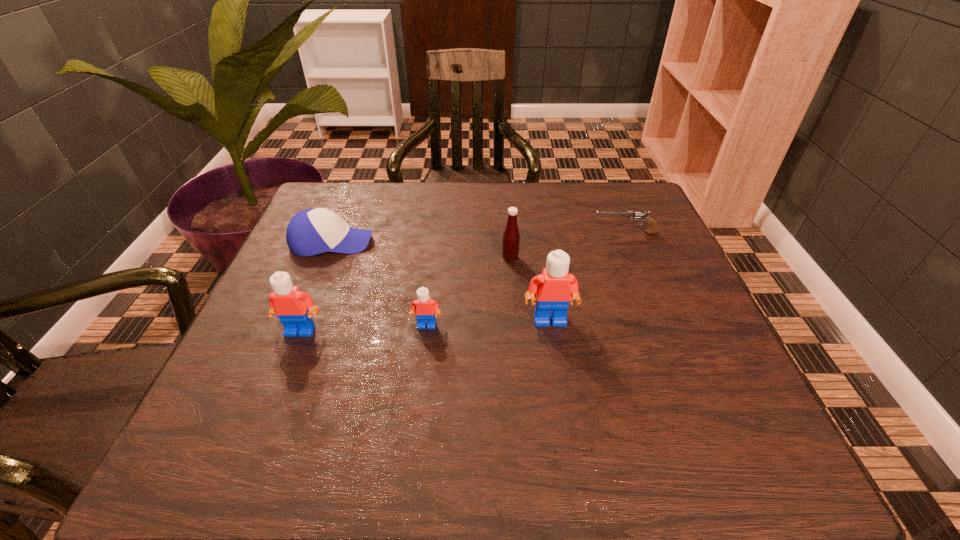
Locate an element on the screen. This screenshot has height=540, width=960. the leftmost Lego is located at coordinates (287, 302).

Identify the location of the fourth object from right to left. The image size is (960, 540). (424, 307).

Locate an element on the screen. The width and height of the screenshot is (960, 540). the shortest Lego is located at coordinates (424, 307).

Find the location of `the rightmost Lego`. the rightmost Lego is located at coordinates tap(555, 287).

Image resolution: width=960 pixels, height=540 pixels. What are the coordinates of `the rightmost object` in the screenshot? It's located at (652, 229).

Where is `gun`? The image size is (960, 540). gun is located at coordinates (652, 229).

You are a GUI agent. You are given a task and a screenshot of the screen. Output one action in this format:
    pyautogui.click(x=<x>, y=<y>)
    Task: Click on the Tabasco sauce
    Image resolution: width=960 pixels, height=540 pixels.
    Given the screenshot: What is the action you would take?
    pyautogui.click(x=511, y=238)

Where is `the fifth tallest object`? This screenshot has height=540, width=960. the fifth tallest object is located at coordinates click(310, 232).

Where is `vacant area situated 0.170m on the face of the leftmost Lego`? vacant area situated 0.170m on the face of the leftmost Lego is located at coordinates pos(267,416).

Where is `free space located on the face of the second Lego from left to right`? The width and height of the screenshot is (960, 540). free space located on the face of the second Lego from left to right is located at coordinates (419, 390).